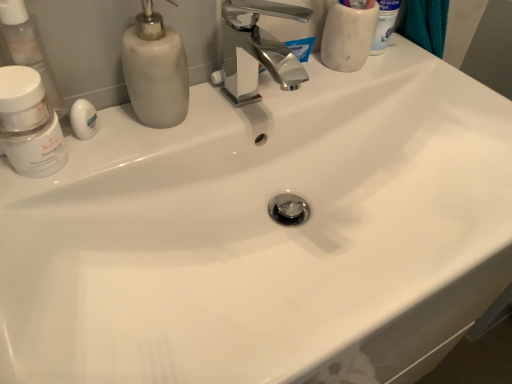
Where is `free space between matte white soap dispenser at upper left and white matte jar at left`? free space between matte white soap dispenser at upper left and white matte jar at left is located at coordinates (118, 147).